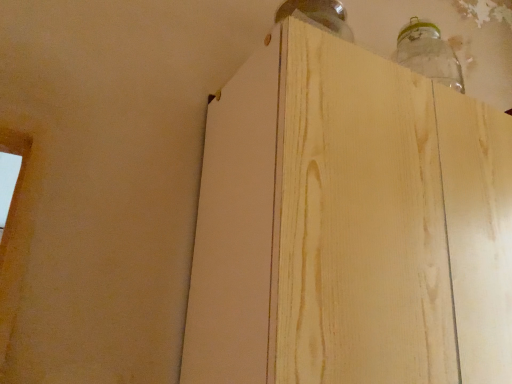
Where is `natural wood cupboard at upper center`? This screenshot has height=384, width=512. natural wood cupboard at upper center is located at coordinates (349, 225).

Consider the image. Measure the distance between point (277, 39) and camera.

Point (277, 39) is 64.50 centimeters away from camera.

The width and height of the screenshot is (512, 384). What do you see at coordinates (349, 225) in the screenshot?
I see `natural wood cupboard at upper center` at bounding box center [349, 225].

This screenshot has width=512, height=384. Identify the location of natural wood cupboard at upper center. (349, 225).